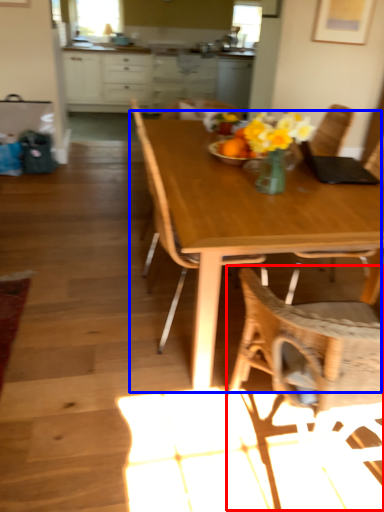
Question: Among these objects, which one is farthest to the camera, chair (highlighted by a red box) or kitchen & dining room table (highlighted by a blue box)?

Choices:
 (A) chair
 (B) kitchen & dining room table

Answer: (B)